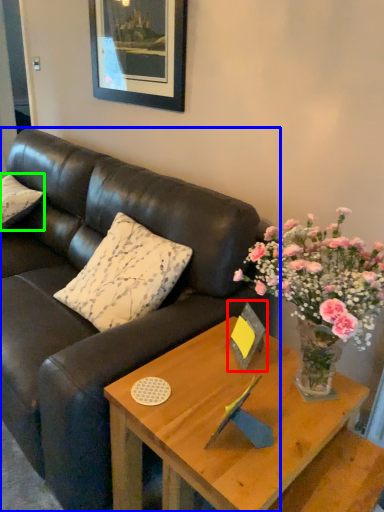
Question: Which object is the closest to the picture frame (highlighted by a red box)? Choose among these: studio couch (highlighted by a blue box) or pillow (highlighted by a green box).

Choices:
 (A) studio couch
 (B) pillow

Answer: (A)